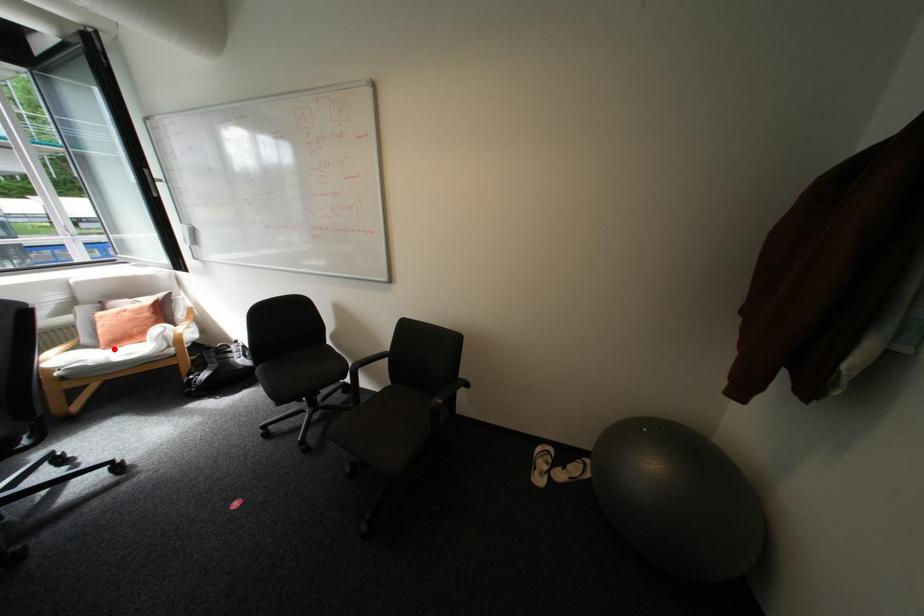
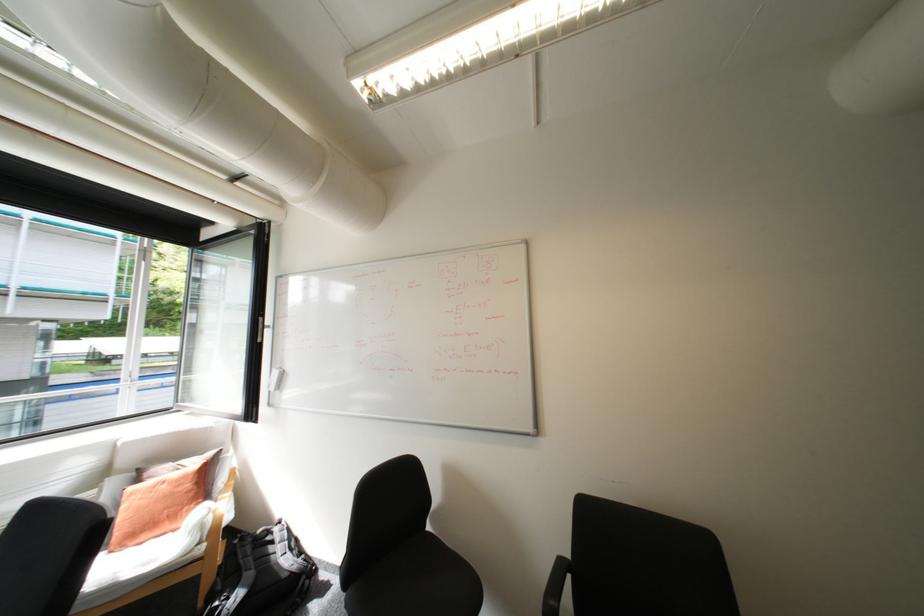
Where in the second image is the point corresponding to the highlighted location from the first image?

(122, 552)